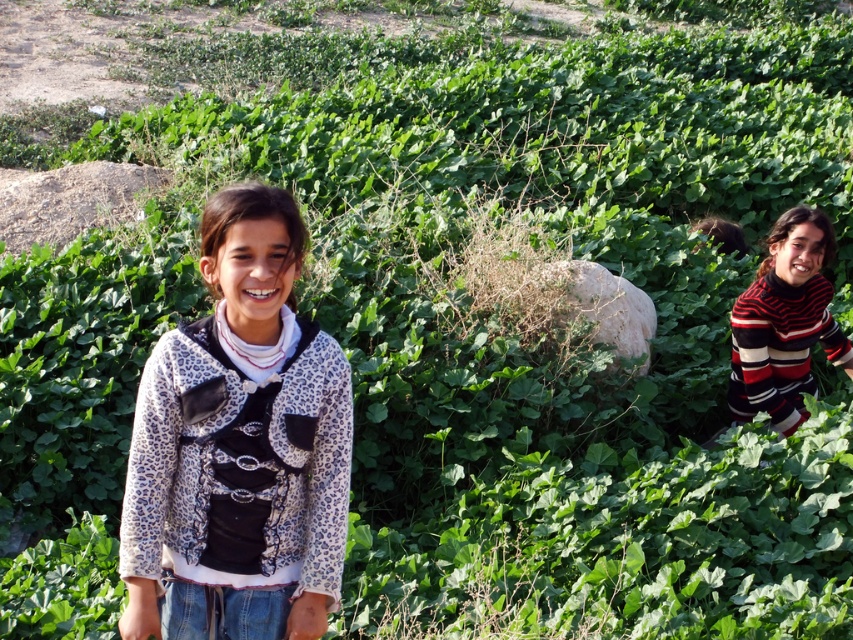
Question: Which point is closer to the camera?

Choices:
 (A) striped sweater at right
 (B) leopard print fabric sweater at center

Answer: (B)

Question: Among these objects, which one is nearest to the camera?

Choices:
 (A) striped sweater at right
 (B) leopard print fabric sweater at center

Answer: (B)

Question: Is leopard print fabric sweater at center bigger than striped sweater at right?

Choices:
 (A) yes
 (B) no

Answer: (B)

Question: Does leopard print fabric sweater at center have a lesser width compared to striped sweater at right?

Choices:
 (A) yes
 (B) no

Answer: (A)

Question: Is leopard print fabric sweater at center further to camera compared to striped sweater at right?

Choices:
 (A) no
 (B) yes

Answer: (A)

Question: Which object is farther from the camera taking this photo?

Choices:
 (A) striped sweater at right
 (B) leopard print fabric sweater at center

Answer: (A)